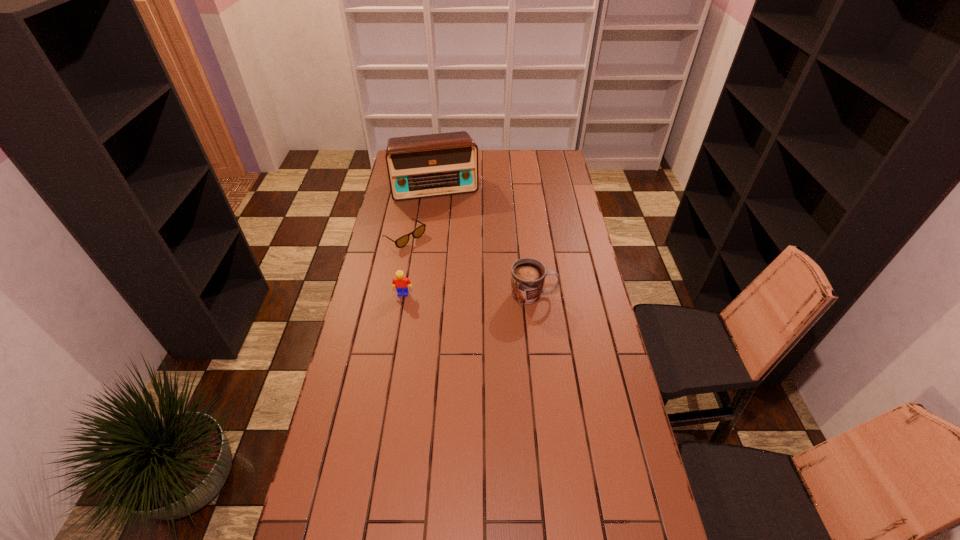
At what (x,y) coordinates should I click in order to perform the action: click on vacant space at the far edge of the desktop. Please return your answer as a coordinate pair (x, y). Looking at the image, I should click on (511, 161).

In the image, there is a desktop. Identify the location of vacant space at the left edge. (341, 454).

Locate an element on the screen. vacant point at the right edge is located at coordinates (552, 263).

I want to click on free space at the far right corner of the desktop, so click(x=539, y=159).

At what (x,y) coordinates should I click in order to perform the action: click on vacant area between the radio receiver and the shortest object. Please return your answer as a coordinate pair (x, y). This screenshot has width=960, height=540. Looking at the image, I should click on (420, 212).

I want to click on vacant space in between the Lego and the radio receiver, so click(420, 240).

You are a GUI agent. You are given a task and a screenshot of the screen. Output one action in this format:
    pyautogui.click(x=<x>, y=<y>)
    Task: Click on the vacant space that is in between the rightmost object and the Lego
    This screenshot has width=960, height=540.
    Given the screenshot: What is the action you would take?
    pyautogui.click(x=468, y=294)

Find the location of a particular element. The width and height of the screenshot is (960, 540). free space between the rightmost object and the Lego is located at coordinates (468, 294).

What are the coordinates of `blank region between the mug and the farthest object` in the screenshot? It's located at point(485,241).

What are the coordinates of `free spot between the rightmost object and the Lego` in the screenshot? It's located at (468, 294).